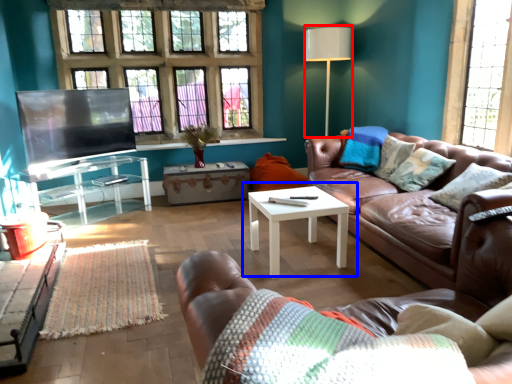
Question: Which of the following is the closest to the observer, lamp (highlighted by a red box) or coffee table (highlighted by a blue box)?

Choices:
 (A) lamp
 (B) coffee table

Answer: (B)